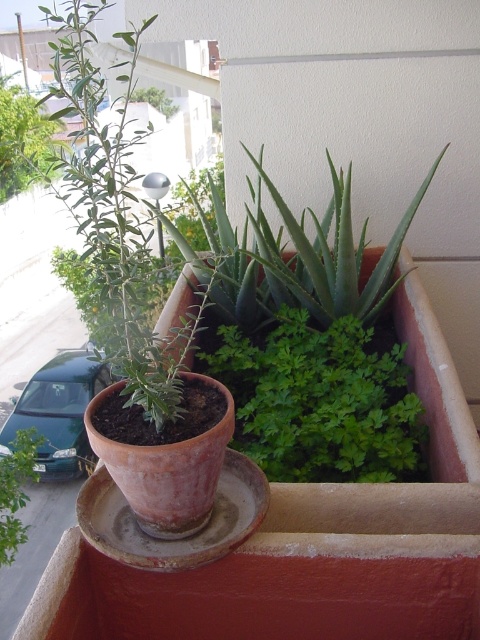
You are a gardener who needs to water both the green leafy plant at center and the green matte plant at center. Your watering can has a maximum reach of 1.2 meters. Can you water both plants without moving the watering can?

The distance between the green leafy plant at center and the green matte plant at center is 1.30 meters, which exceeds the watering can reach of 1.2 meters. Therefore, you cannot water both plants without moving the watering can.

You are designing a garden layout and need to place both the green leafy plant at center and the green matte plant at center in a row. Which plant should you place first if you want the thinner plant to be on the left side?

You should place the green leafy plant at center first on the left side since it is thinner than the green matte plant at center.